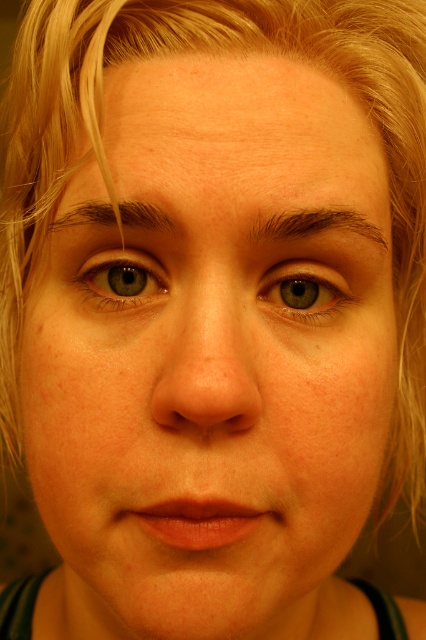
Does green matte eye at upper left lie behind brown textured eyebrow at upper center?

Yes, it is behind brown textured eyebrow at upper center.

Which is more to the left, green matte eye at upper left or brown textured eyebrow at upper center?

green matte eye at upper left

Between point (150, 262) and point (345, 218), which one is positioned in front?

Point (345, 218)

Image resolution: width=426 pixels, height=640 pixels. I want to click on green matte eye at upper left, so click(121, 278).

In the scene shown: Between brown textured eyebrow at upper center and dark brown hair at upper center, which one has more height?

brown textured eyebrow at upper center is taller.

Describe the element at coordinates (314, 225) in the screenshot. I see `brown textured eyebrow at upper center` at that location.

You are a GUI agent. You are given a task and a screenshot of the screen. Output one action in this format:
    pyautogui.click(x=<x>, y=<y>)
    Task: Click on the brown textured eyebrow at upper center
    Image resolution: width=426 pixels, height=640 pixels.
    Given the screenshot: What is the action you would take?
    pyautogui.click(x=314, y=225)

Where is `brown textured eyebrow at upper center`? This screenshot has height=640, width=426. brown textured eyebrow at upper center is located at coordinates click(x=314, y=225).

Between green matte eye at center and brown textured eyebrow at upper center, which one has more height?

green matte eye at center is taller.

Between point (324, 294) and point (287, 237), which one is positioned in front?

Point (287, 237) is more forward.

Does point (305, 276) come farther from viewer compared to point (307, 227)?

Yes, it is behind point (307, 227).

Find the location of a particular element. green matte eye at center is located at coordinates click(305, 291).